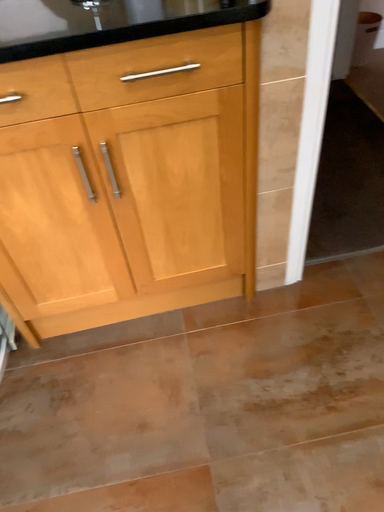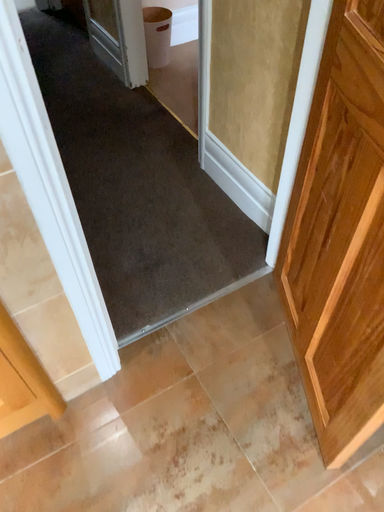
Question: How did the camera likely rotate when shooting the video?

Choices:
 (A) rotated left
 (B) rotated right

Answer: (B)